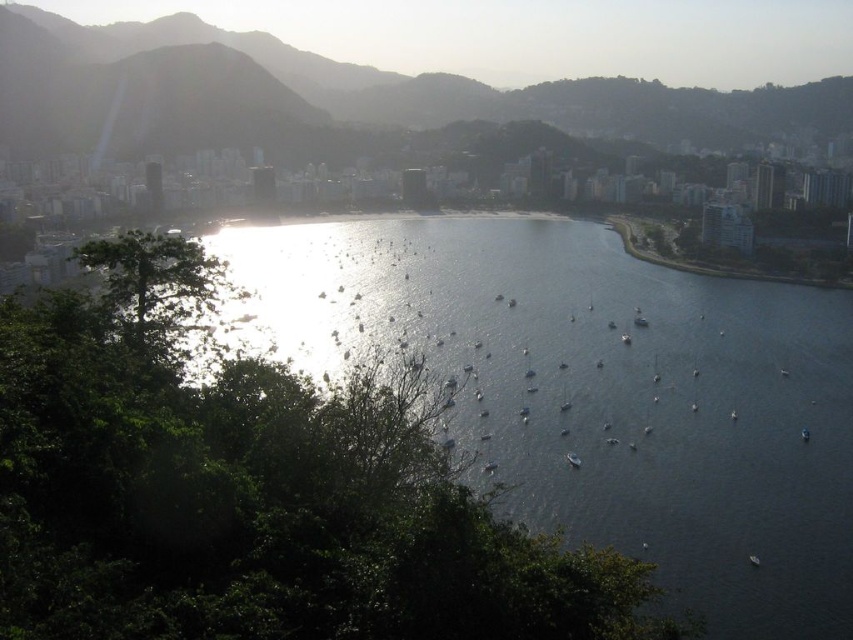
Is point (73, 410) positioned in front of point (679, 104)?

Yes.

Who is taller, green leafy tree at center-left or green textured mountain at upper center?

Standing taller between the two is green leafy tree at center-left.

Is point (543, 541) behind point (708, 108)?

No.

Locate an element on the screen. This screenshot has height=640, width=853. green leafy tree at center-left is located at coordinates (252, 490).

Looking at this image, is green leafy tree at center-left positioned at the back of green leafy tree at left?

No, it is not.

Does green leafy tree at center-left appear over green leafy tree at left?

Incorrect, green leafy tree at center-left is not positioned above green leafy tree at left.

Who is more forward, (641, 625) or (189, 314)?

Point (641, 625) is more forward.

Where is `green leafy tree at center-left`? This screenshot has width=853, height=640. green leafy tree at center-left is located at coordinates (252, 490).

Who is lower down, green textured mountain at upper center or green leafy tree at left?

Positioned lower is green leafy tree at left.

Locate an element on the screen. The height and width of the screenshot is (640, 853). green textured mountain at upper center is located at coordinates pos(503,92).